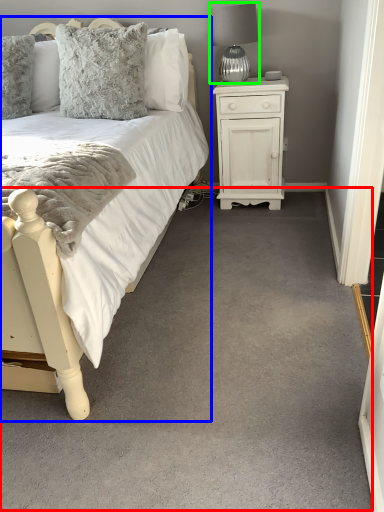
Question: Which is farther away from plain (highlighted by a red box)? bed (highlighted by a blue box) or table lamp (highlighted by a green box)?

Choices:
 (A) bed
 (B) table lamp

Answer: (B)